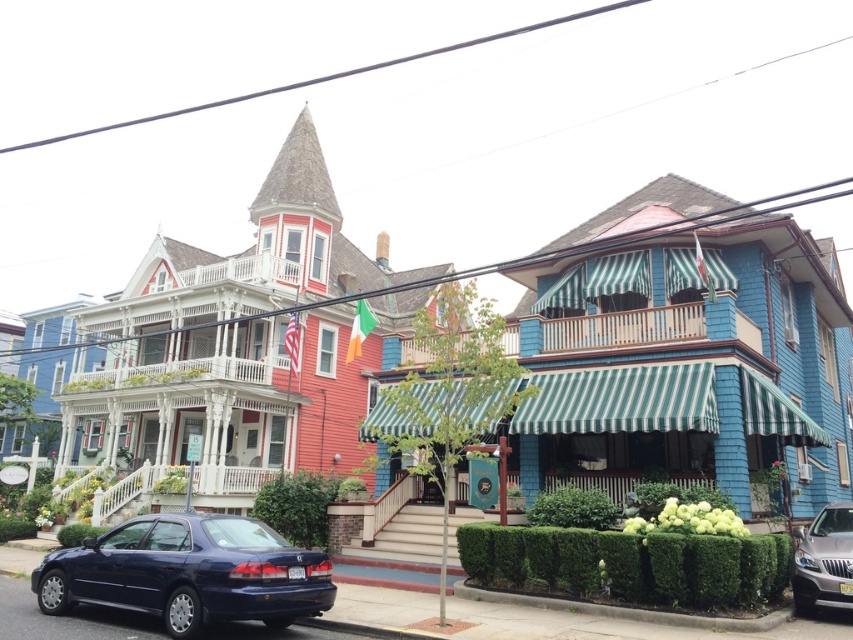
You are driving a delivery van that is 2.5 meters wide. You need to park your van in the parking spot near the red concrete curb at lower center. However, there is a silver metallic suv at lower right parked nearby. Can your van fit in the parking spot without overlapping the curb?

The silver metallic suv at lower right has a lesser width compared to the red concrete curb at lower center. Since the SUV is narrower than the curb, there might be enough space for the van. However, the exact width of the parking spot isn

You are a delivery person approaching the two houses. You need to park your silver metallic suv at lower right. The green leafy hedge at lower center is blocking the driveway. Can you move the suv around the hedge?

The green leafy hedge at lower center is to the left of the silver metallic suv at lower right. Since the hedge is on the left side of the SUV, you can maneuver the SUV to the right side of the hedge to access the driveway without obstruction.